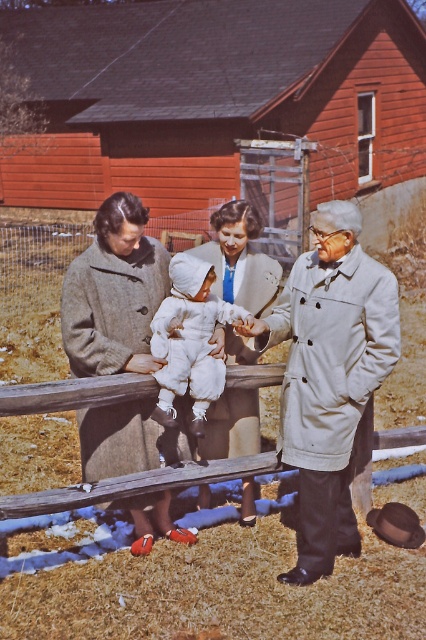
Question: Does white woolen suit at center come behind white fluffy snowsuit at center?

Choices:
 (A) yes
 (B) no

Answer: (B)

Question: Which of these objects is positioned farthest from the white wool coat at center?

Choices:
 (A) light beige trench coat at center
 (B) white fluffy snowsuit at center
 (C) white woolen suit at center

Answer: (A)

Question: Which point is closer to the camera taking this photo?

Choices:
 (A) (351, 294)
 (B) (325, 221)

Answer: (B)

Question: Is light beige trench coat at center smaller than white fluffy snowsuit at center?

Choices:
 (A) no
 (B) yes

Answer: (A)

Question: Considering the real-world distances, which object is closest to the cozy wool coat at center?

Choices:
 (A) light beige trench coat at center
 (B) white fluffy snowsuit at center
 (C) white wool coat at center
 (D) white woolen suit at center

Answer: (B)

Question: Can you confirm if cozy wool coat at center is positioned below white fluffy snowsuit at center?

Choices:
 (A) yes
 (B) no

Answer: (A)